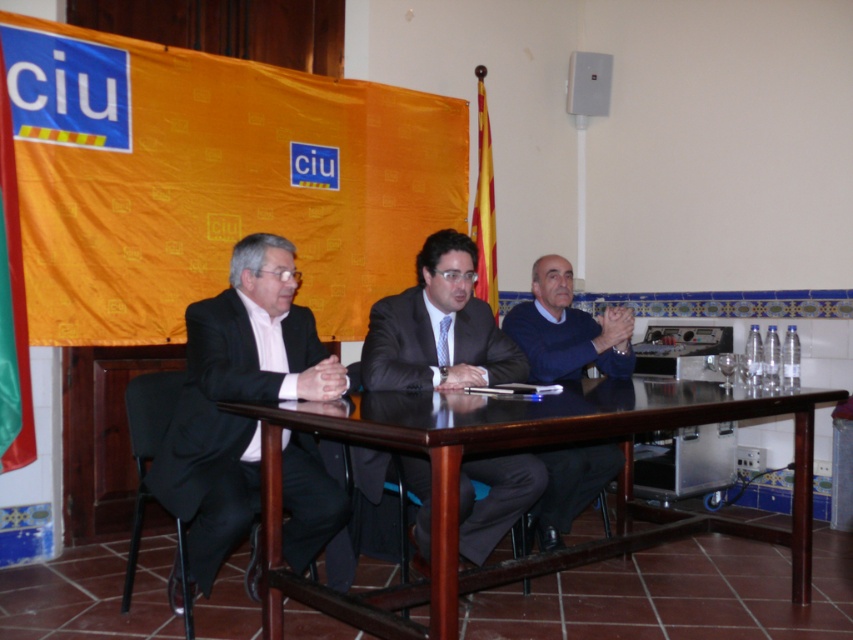
Does matte black suit at left have a smaller size compared to matte black suit at center?

No.

Can you confirm if matte black suit at left is positioned above matte black suit at center?

Incorrect, matte black suit at left is not positioned above matte black suit at center.

Does point (311, 497) come in front of point (393, 316)?

Yes, point (311, 497) is in front of point (393, 316).

This screenshot has width=853, height=640. What are the coordinates of `matte black suit at left` in the screenshot? It's located at (236, 397).

Between point (598, 385) and point (498, 474), which one is positioned in front?

Point (498, 474) is more forward.

Is mahogany wood table at center positioned at the back of matte black suit at center?

No, mahogany wood table at center is in front of matte black suit at center.

Is point (451, 392) positioned before point (468, 324)?

Yes, it is.

Find the location of `mahogany wood table at center`. mahogany wood table at center is located at coordinates (512, 449).

Which is above, mahogany wood table at center or dark blue sweater at center?

Positioned higher is dark blue sweater at center.

Which is more to the right, mahogany wood table at center or dark blue sweater at center?

Positioned to the right is dark blue sweater at center.

The height and width of the screenshot is (640, 853). Identify the location of mahogany wood table at center. (512, 449).

Locate an element on the screen. The width and height of the screenshot is (853, 640). mahogany wood table at center is located at coordinates (512, 449).